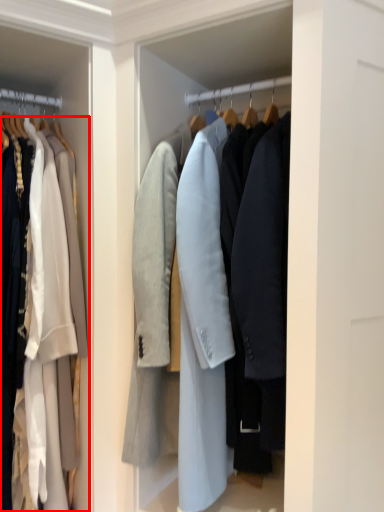
Question: From the image, what is the correct spatial relationship of coat (annotated by the red box) in relation to coat?

Choices:
 (A) right
 (B) left

Answer: (B)